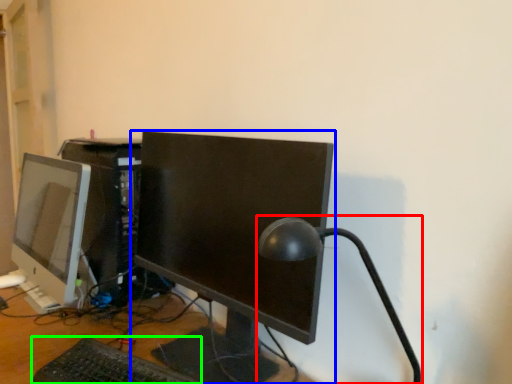
Question: Which object is positioned farthest from table lamp (highlighted by a red box)? Select from computer monitor (highlighted by a blue box) and computer keyboard (highlighted by a green box).

Choices:
 (A) computer monitor
 (B) computer keyboard

Answer: (B)